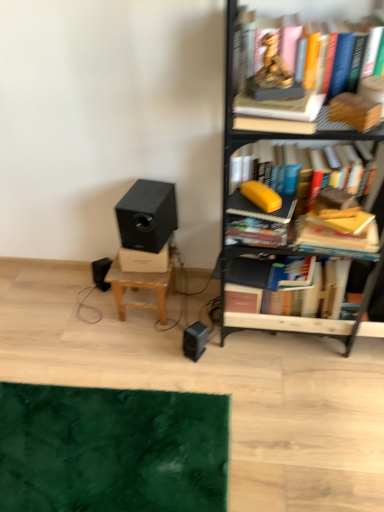
Locate an element on the screen. free spot behind black plastic speaker at lower center is located at coordinates (197, 317).